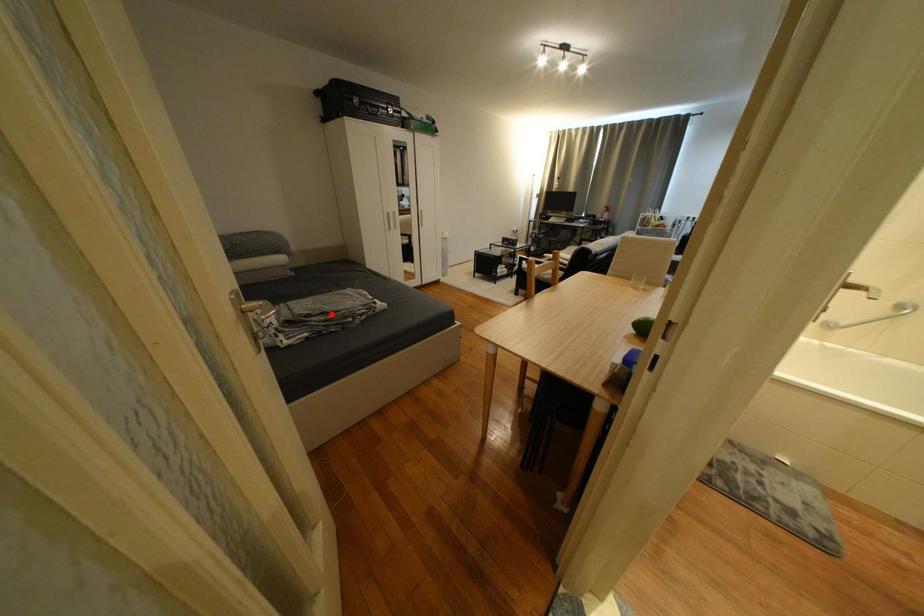
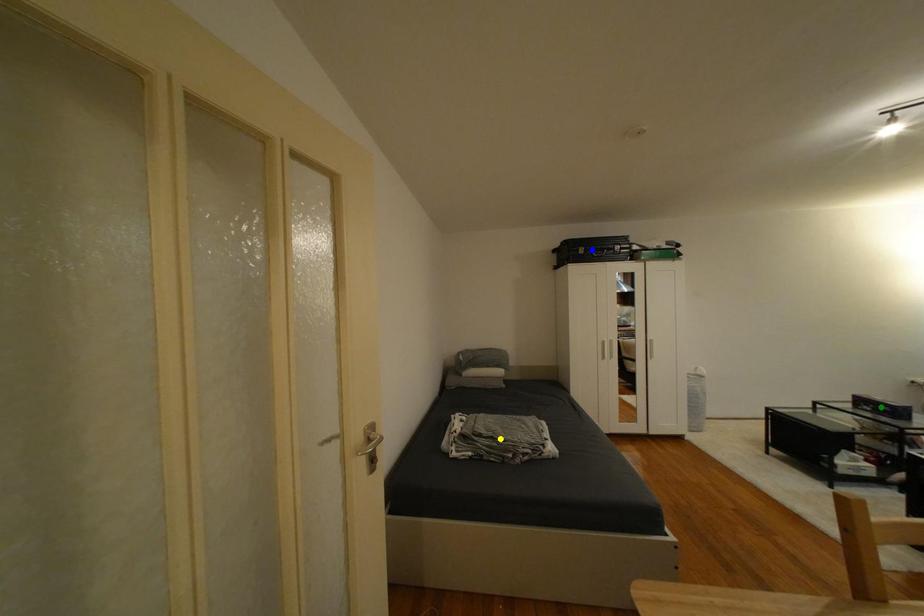
Question: I am providing you with two images of the same scene from different viewpoints. A red point is marked on the first image. You are given multiple points on the second image. Which point in image 2 is actually the same real-world point as the red point in image 1?

Choices:
 (A) green point
 (B) blue point
 (C) yellow point

Answer: (C)